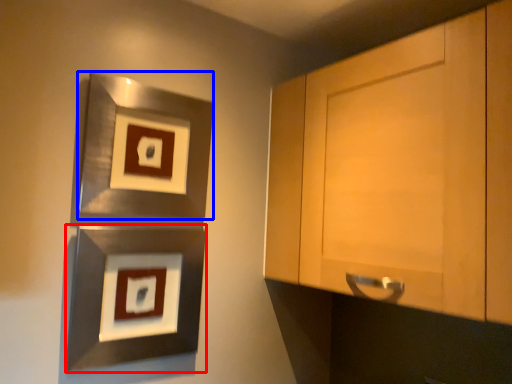
Question: Among these objects, which one is farthest to the camera, picture frame (highlighted by a red box) or picture frame (highlighted by a blue box)?

Choices:
 (A) picture frame
 (B) picture frame

Answer: (B)